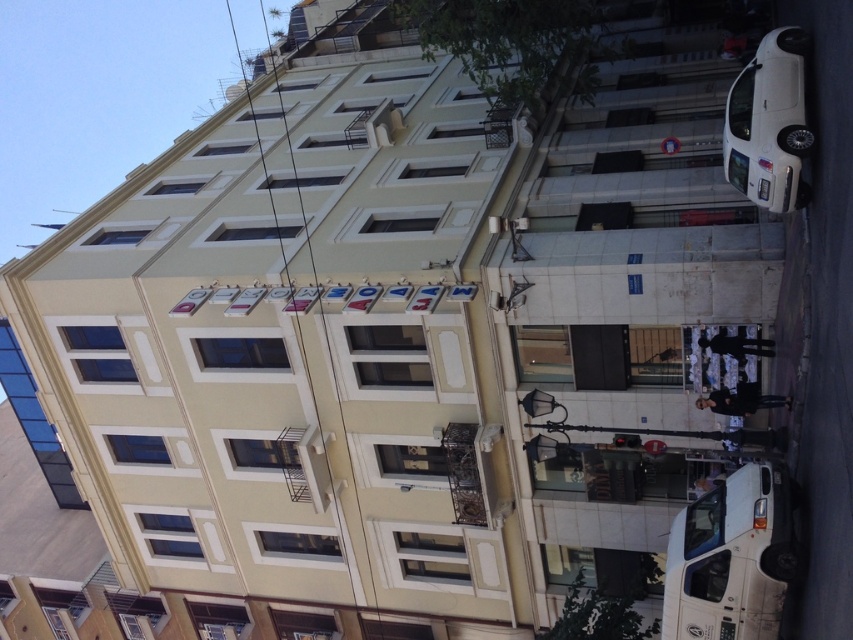
Question: Which point is farther from the camera taking this photo?

Choices:
 (A) (746, 170)
 (B) (700, 545)

Answer: (A)

Question: Is white matte van at lower right wider than white glossy car at right?

Choices:
 (A) yes
 (B) no

Answer: (A)

Question: Which of the following is the closest to the observer?

Choices:
 (A) (746, 145)
 (B) (740, 556)

Answer: (B)

Question: Can you confirm if white matte van at lower right is positioned to the left of white glossy car at right?

Choices:
 (A) no
 (B) yes

Answer: (B)

Question: Can you confirm if white matte van at lower right is positioned above white glossy car at right?

Choices:
 (A) yes
 (B) no

Answer: (B)